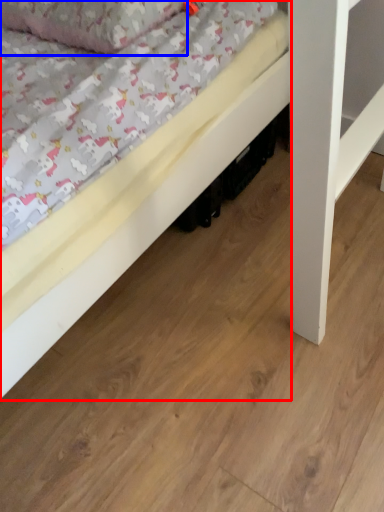
Question: Among these objects, which one is nearest to the camera, bed (highlighted by a red box) or pillow (highlighted by a blue box)?

Choices:
 (A) bed
 (B) pillow

Answer: (A)